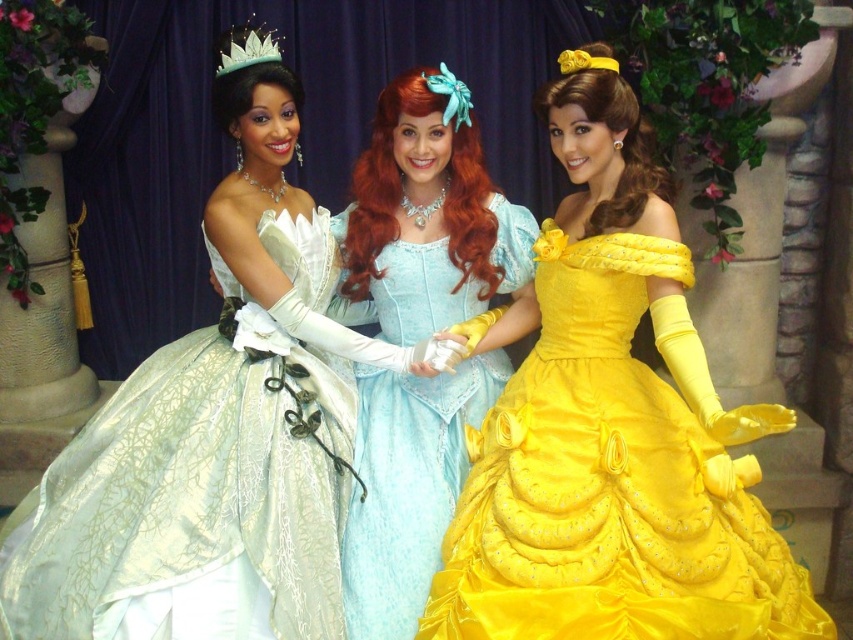
You are a photographer at the event and want to capture a shot where the matte green gown at center is in focus while keeping the yellow satin tiara at upper center slightly out of focus. Is this possible given their positions?

Yes, because the matte green gown at center is closer to the viewer than the yellow satin tiara at upper center, adjusting the camera focus to the closer gown can keep the tiara slightly blurred.